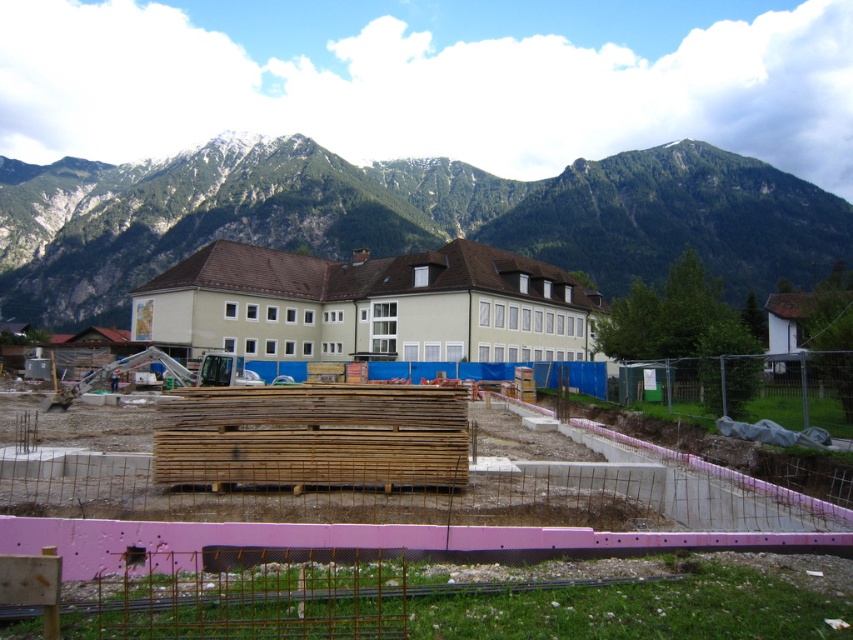
Question: Is wooden planks at center further to the viewer compared to green rocky mountains at upper center?

Choices:
 (A) no
 (B) yes

Answer: (A)

Question: Which of the following is the closest to the observer?

Choices:
 (A) wooden planks at center
 (B) green rocky mountains at upper center

Answer: (A)

Question: Which point is closer to the camera?

Choices:
 (A) (331, 515)
 (B) (663, 209)

Answer: (A)

Question: Does wooden planks at center have a larger size compared to green rocky mountains at upper center?

Choices:
 (A) no
 (B) yes

Answer: (A)

Question: Can you confirm if wooden planks at center is smaller than green rocky mountains at upper center?

Choices:
 (A) no
 (B) yes

Answer: (B)

Question: Which of the following is the closest to the observer?

Choices:
 (A) green rocky mountains at upper center
 (B) wooden planks at center

Answer: (B)